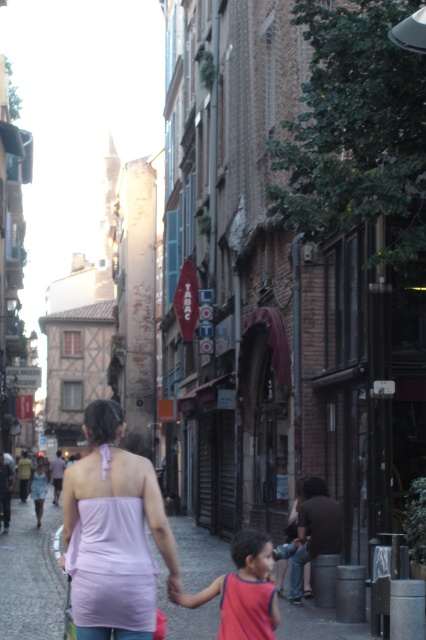
You are a fashion designer observing the street scene. You notice two clothing items of interest. The first is a lavender satin halter top at center and the second is a red sleeveless shirt at lower center. Which clothing item has a larger size?

The lavender satin halter top at center is bigger than the red sleeveless shirt at lower center.

You are a fashion designer observing a street scene and notice two garments displayed in the image. The first is a lavender satin halter top at center, and the second is a red sleeveless shirt at lower center. Which of these garments has a greater width when laid flat?

The lavender satin halter top at center has a greater width than the red sleeveless shirt at lower center when laid flat.